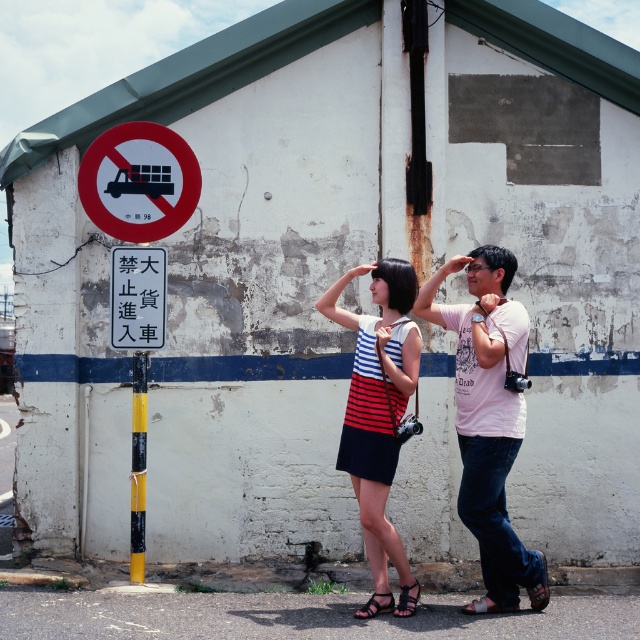
You are a delivery driver with a large truck. You see the red circle sign at upper left and the yellow painted pole at lower center. According to traffic rules, which object indicates where you cannot drive your truck?

The red circle sign at upper left indicates where you cannot drive your truck because it is a prohibition sign with a truck silhouette, while the yellow painted pole at lower center is unrelated to vehicle restrictions.

You are a delivery driver who needs to park your vehicle near the white plastic sign at center and the yellow painted pole at lower center. Based on their positions, which object should you approach first if you are coming from the left side of the scene?

The yellow painted pole at lower center should be approached first because the white plastic sign at center is to the right of it, meaning the pole is closer to the left side of the scene.

You are standing at the center of the image. Which direction should you look to see the red circle sign at upper left?

The red circle sign at upper left is located at the upper left direction from your current position at the center of the image.